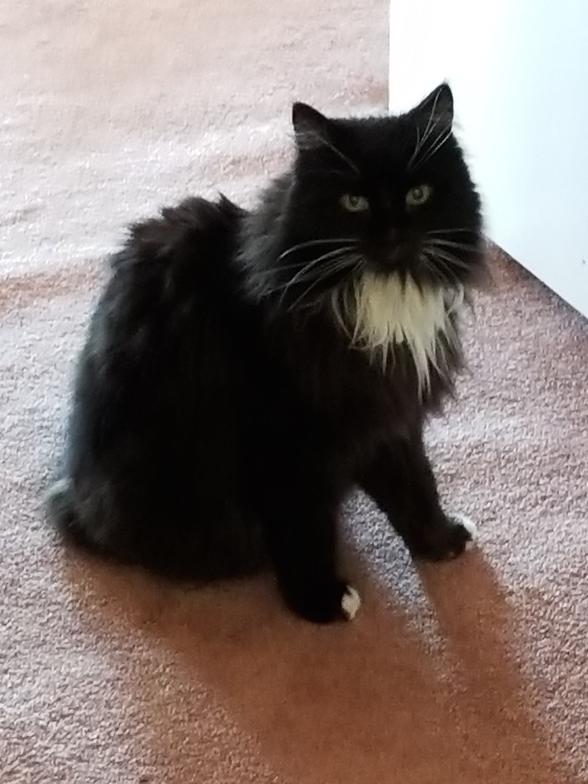
Locate an element on the screen. Image resolution: width=588 pixels, height=784 pixels. white paint on wall is located at coordinates (537, 96).